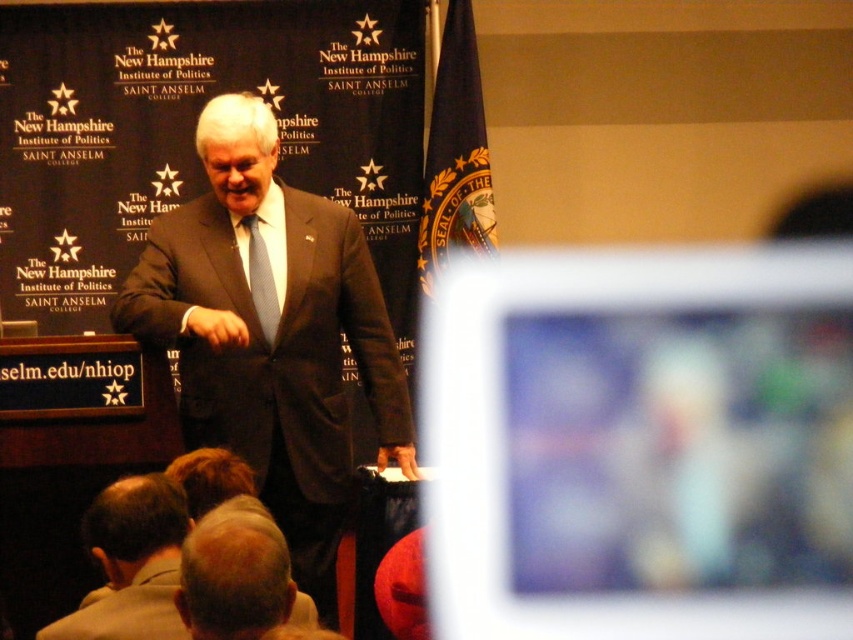
You are an event photographer at the New Hampshire Institute of Politics event. You need to capture a closeup shot of the speaker. Which object, the light brown hair at lower center or the light blue textured tie at center, should you focus on if you want to highlight something closer to the camera?

The light brown hair at lower center is closer to the camera than the light blue textured tie at center because it is shorter, so focusing on the light brown hair at lower center would highlight the closer object.